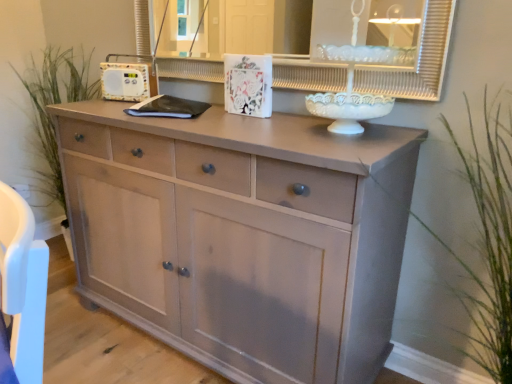
Question: In terms of height, does green grass at right, marked as the first plant in a front-to-back arrangement, look taller or shorter compared to white glossy medicine cabinet at upper center?

Choices:
 (A) short
 (B) tall

Answer: (B)

Question: In the image, is green grass at right, the 2th plant in the back-to-front sequence, on the left side or the right side of white glossy medicine cabinet at upper center?

Choices:
 (A) left
 (B) right

Answer: (B)

Question: Estimate the real-world distances between objects in this image. Which object is closer to the green grass at right, placed as the first plant when sorted from right to left?

Choices:
 (A) white glossy medicine cabinet at upper center
 (B) matte light wood chest of drawers at center
 (C) green grass at left, the first plant in the left-to-right sequence

Answer: (A)

Question: Estimate the real-world distances between objects in this image. Which object is farther from the green grass at left, placed as the second plant when sorted from front to back?

Choices:
 (A) white glossy medicine cabinet at upper center
 (B) green grass at right, marked as the first plant in a front-to-back arrangement
 (C) matte light wood chest of drawers at center

Answer: (B)